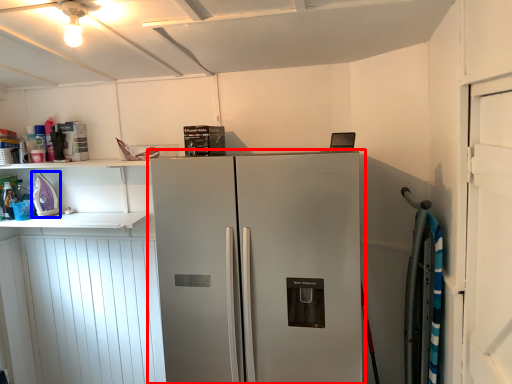
Question: Among these objects, which one is nearest to the camera, refrigerator (highlighted by a red box) or appliance (highlighted by a blue box)?

Choices:
 (A) refrigerator
 (B) appliance

Answer: (A)